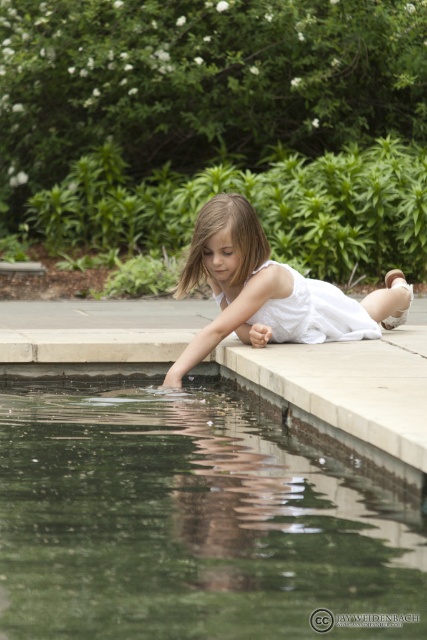
Is green reflective water at lower center in front of white cotton dress at center?

That is True.

Between green reflective water at lower center and white cotton dress at center, which one is positioned higher?

Positioned higher is white cotton dress at center.

What do you see at coordinates (193, 518) in the screenshot?
I see `green reflective water at lower center` at bounding box center [193, 518].

This screenshot has height=640, width=427. What are the coordinates of `green reflective water at lower center` in the screenshot? It's located at (193, 518).

Can you confirm if white cotton dress at center is taller than white lace dress at center?

Yes.

Between point (351, 307) and point (222, 292), which one is positioned in front?

Positioned in front is point (222, 292).

Where is `white cotton dress at center`? This screenshot has height=640, width=427. white cotton dress at center is located at coordinates (269, 291).

Is green reflective water at lower center shorter than white lace dress at center?

Yes, green reflective water at lower center is shorter than white lace dress at center.

Does green reflective water at lower center appear over white lace dress at center?

No, green reflective water at lower center is not above white lace dress at center.

Where is `green reflective water at lower center`? The height and width of the screenshot is (640, 427). green reflective water at lower center is located at coordinates (193, 518).

Where is `green reflective water at lower center`? green reflective water at lower center is located at coordinates (x=193, y=518).